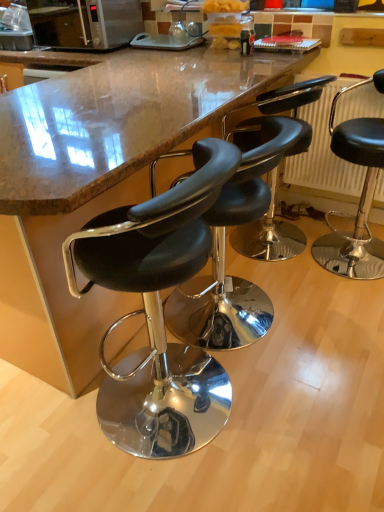
Question: Considering the relative positions of black leather stool at center, which is counted as the 3th chair, starting from the left, and metallic radiator at right in the image provided, is black leather stool at center, which is counted as the 3th chair, starting from the left, to the left of metallic radiator at right from the viewer's perspective?

Choices:
 (A) no
 (B) yes

Answer: (B)

Question: From the image's perspective, is black leather stool at center, which is counted as the 3th chair, starting from the left, beneath metallic radiator at right?

Choices:
 (A) yes
 (B) no

Answer: (A)

Question: Is black leather stool at center, which is counted as the 3th chair, starting from the left, smaller than metallic radiator at right?

Choices:
 (A) no
 (B) yes

Answer: (A)

Question: Is black leather stool at center, which is counted as the 3th chair, starting from the left, positioned in front of metallic radiator at right?

Choices:
 (A) yes
 (B) no

Answer: (A)

Question: Does black leather stool at center, which is counted as the 3th chair, starting from the left, have a greater width compared to metallic radiator at right?

Choices:
 (A) no
 (B) yes

Answer: (B)

Question: Is black leather stool at center, which is the 2th chair from right to left, spatially inside black leather stool at center, which is the third chair in right-to-left order, or outside of it?

Choices:
 (A) inside
 (B) outside

Answer: (B)

Question: In the image, is black leather stool at center, which is the 2th chair from right to left, positioned in front of or behind black leather stool at center, which is the third chair in right-to-left order?

Choices:
 (A) front
 (B) behind

Answer: (B)

Question: Is point (304, 132) closer or farther from the camera than point (261, 182)?

Choices:
 (A) closer
 (B) farther

Answer: (B)

Question: Looking at their shapes, would you say black leather stool at center, which is counted as the 3th chair, starting from the left, is wider or thinner than black leather stool at center, which is the third chair in right-to-left order?

Choices:
 (A) thin
 (B) wide

Answer: (A)

Question: Looking at their shapes, would you say black leather stool at right, arranged as the 1th chair when viewed from the right, is wider or thinner than black leather stool at center, which is the third chair in right-to-left order?

Choices:
 (A) thin
 (B) wide

Answer: (A)

Question: Based on their sizes in the image, would you say black leather stool at right, which is the fourth chair in left-to-right order, is bigger or smaller than black leather stool at center, which is the third chair in right-to-left order?

Choices:
 (A) big
 (B) small

Answer: (B)

Question: From a real-world perspective, is black leather stool at right, arranged as the 1th chair when viewed from the right, physically located above or below black leather stool at center, which appears as the 2th chair when viewed from the left?

Choices:
 (A) above
 (B) below

Answer: (A)

Question: In the image, is black leather stool at right, arranged as the 1th chair when viewed from the right, on the left side or the right side of black leather stool at center, which is the third chair in right-to-left order?

Choices:
 (A) left
 (B) right

Answer: (B)

Question: Relative to marble countertop at center, is black leather stool at center, positioned as the first chair in left-to-right order, in front or behind?

Choices:
 (A) front
 (B) behind

Answer: (A)

Question: Is black leather stool at center, which is the fourth chair in right-to-left order, to the left or to the right of marble countertop at center in the image?

Choices:
 (A) right
 (B) left

Answer: (A)